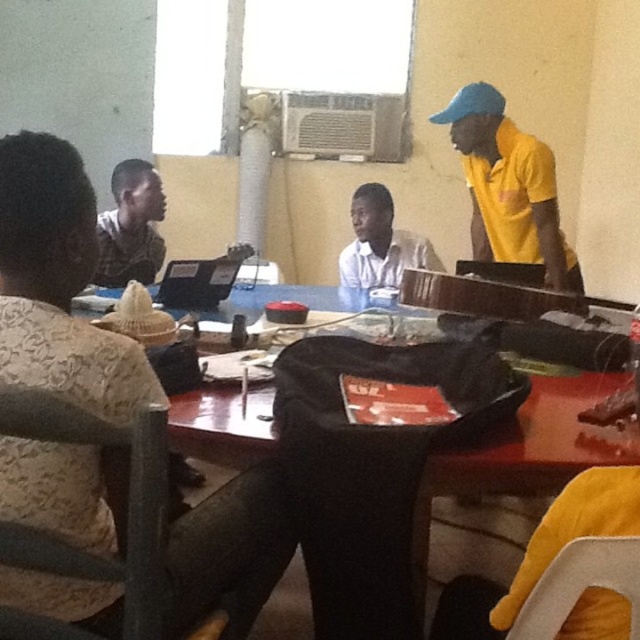
Can you confirm if yellow matte shirt at upper right is positioned above black fabric bag at center?

Correct, yellow matte shirt at upper right is located above black fabric bag at center.

Between yellow matte shirt at upper right and black fabric bag at center, which one appears on the right side from the viewer's perspective?

yellow matte shirt at upper right

The width and height of the screenshot is (640, 640). I want to click on yellow matte shirt at upper right, so click(508, 186).

Does yellow matte shirt at upper right have a lesser width compared to white matte shirt at center?

Incorrect, yellow matte shirt at upper right's width is not less than white matte shirt at center's.

Does yellow matte shirt at upper right have a greater height compared to white matte shirt at center?

Correct, yellow matte shirt at upper right is much taller as white matte shirt at center.

Image resolution: width=640 pixels, height=640 pixels. I want to click on yellow matte shirt at upper right, so click(508, 186).

Which is above, black fabric bag at center or matte black shirt at center?

matte black shirt at center is above.

In the scene shown: Which of these two, black fabric bag at center or matte black shirt at center, stands taller?

With more height is matte black shirt at center.

Who is more distant from viewer, (602, 388) or (147, 257)?

Point (147, 257)

Where is `black fabric bag at center`? This screenshot has width=640, height=640. black fabric bag at center is located at coordinates (515, 456).